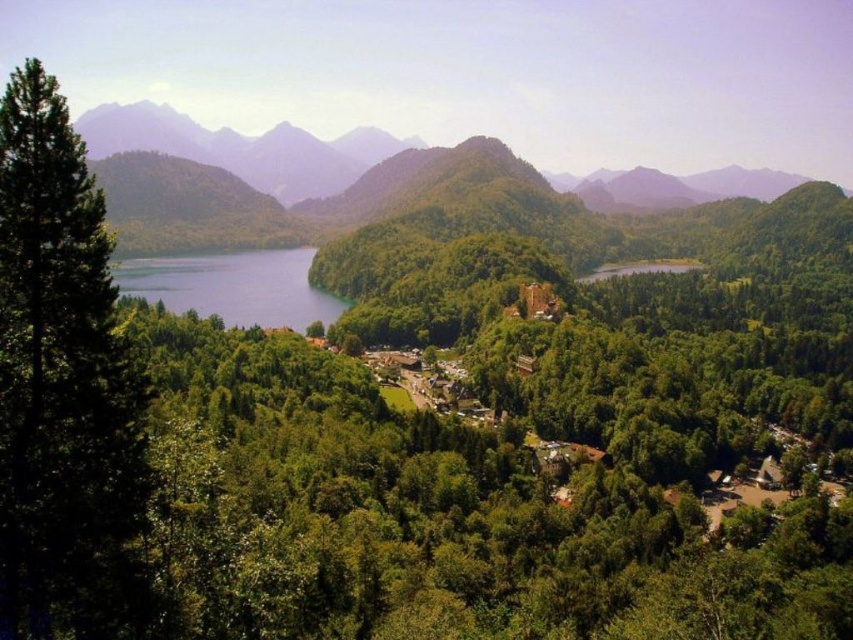
You are a hiker standing at the edge of the forest. You notice the green textured tree at left and the blue water at center left. Which object appears closer to you based on their sizes?

The green textured tree at left appears closer because it has a smaller size compared to the blue water at center left, which is typically farther away in such landscapes.